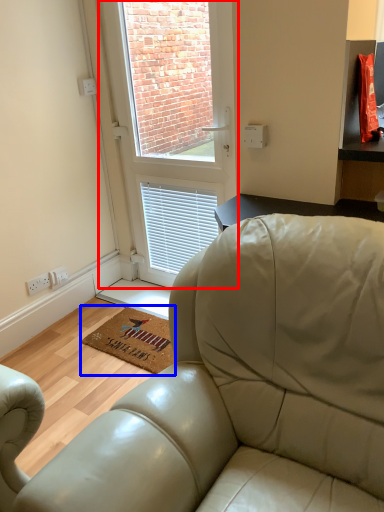
Question: Which object is further to the camera taking this photo, window (highlighted by a red box) or mat (highlighted by a blue box)?

Choices:
 (A) window
 (B) mat

Answer: (B)